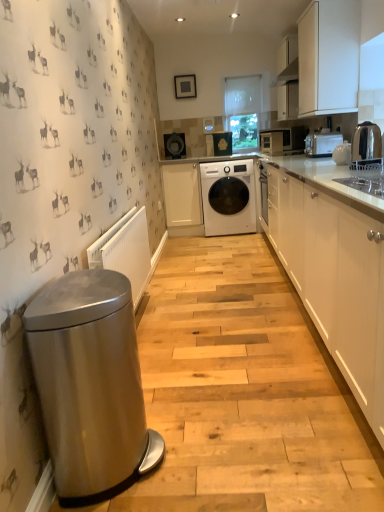
Question: Considering the positions of point (180, 135) and point (294, 131), is point (180, 135) closer or farther from the camera than point (294, 131)?

Choices:
 (A) closer
 (B) farther

Answer: (B)

Question: Is matte black washing machine at center, marked as the 3th appliance in a bottom-to-top arrangement, bigger or smaller than matte black microwave at upper right, the first home appliance viewed from the back?

Choices:
 (A) big
 (B) small

Answer: (B)

Question: Which is farther from the matte black washing machine at center, positioned as the fourth appliance in right-to-left order?

Choices:
 (A) matte black washing machine at center, placed as the fourth appliance when sorted from bottom to top
 (B) metallic silver toaster at upper right, the second home appliance from the top
 (C) stainless steel trash can at left
 (D) matte black microwave at upper right, the first home appliance viewed from the back
 (E) white matte cabinet at center, which is counted as the 1th cabinetry, starting from the left

Answer: (C)

Question: Which object is positioned farthest from the polished stainless steel kettle at right?

Choices:
 (A) matte white microwave at center, which is counted as the third appliance, starting from the back
 (B) metallic silver toaster at upper right, which ranks as the 1th home appliance in bottom-to-top order
 (C) stainless steel trash can at left
 (D) white ceramic teapot at upper right, which is counted as the fourth appliance, starting from the left
 (E) white plastic radiator at lower left

Answer: (C)